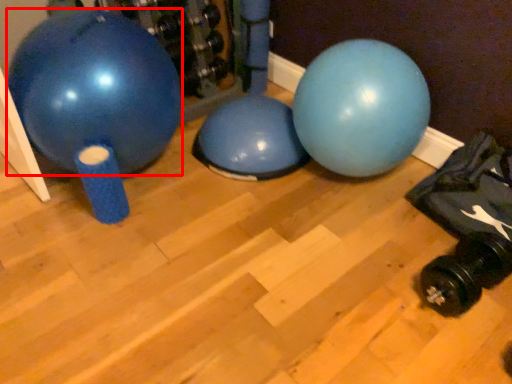
Question: Considering the relative positions of ball (annotated by the red box) and dumbbell in the image provided, where is ball (annotated by the red box) located with respect to the staircase?

Choices:
 (A) left
 (B) right

Answer: (A)